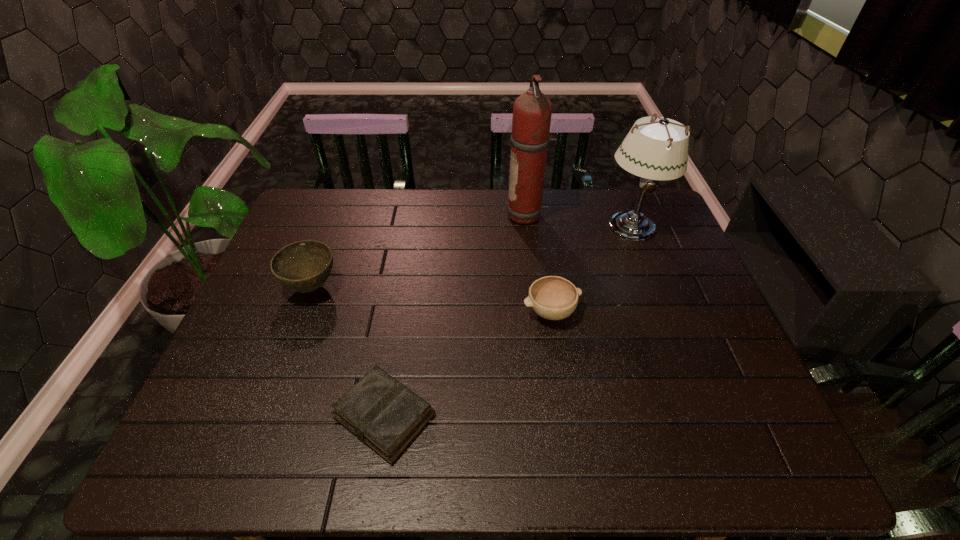
Identify the location of free space between the fire extinguisher and the rightmost object. (579, 221).

At what (x,y) coordinates should I click in order to perform the action: click on free point between the nearest object and the second tallest object. Please return your answer as a coordinate pair (x, y). The image size is (960, 540). Looking at the image, I should click on (508, 321).

Image resolution: width=960 pixels, height=540 pixels. What are the coordinates of `free space between the fire extinguisher and the lampshade` in the screenshot? It's located at (579, 221).

The image size is (960, 540). In order to click on blank region between the tallest object and the right bowl in this screenshot , I will do `click(539, 264)`.

Locate an element on the screen. The height and width of the screenshot is (540, 960). empty space between the taller bowl and the fourth tallest object is located at coordinates (431, 299).

In order to click on vacant area that lies between the leftmost object and the fire extinguisher in this screenshot , I will do `click(420, 252)`.

Where is `vacant area that lies between the right bowl and the rightmost object`? The image size is (960, 540). vacant area that lies between the right bowl and the rightmost object is located at coordinates (591, 269).

The width and height of the screenshot is (960, 540). Find the location of `object that is the third closest to the taller bowl`. object that is the third closest to the taller bowl is located at coordinates (532, 110).

Where is `object identified as the closest to the tallest object`? Image resolution: width=960 pixels, height=540 pixels. object identified as the closest to the tallest object is located at coordinates (658, 150).

Locate an element on the screen. Image resolution: width=960 pixels, height=540 pixels. vacant point that satisfies the following two spatial constraints: 1. on the front side of the nearest object; 2. on the left side of the left bowl is located at coordinates point(264,416).